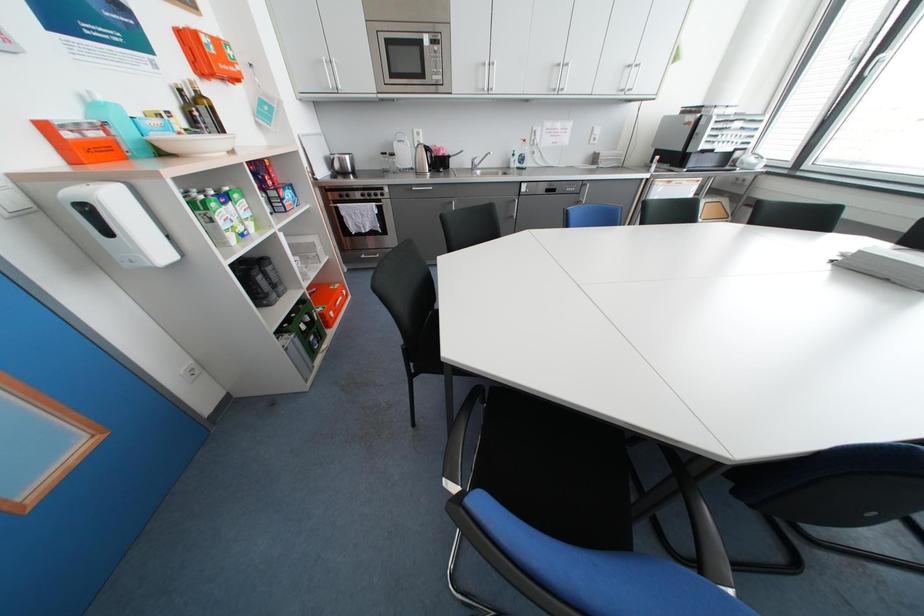
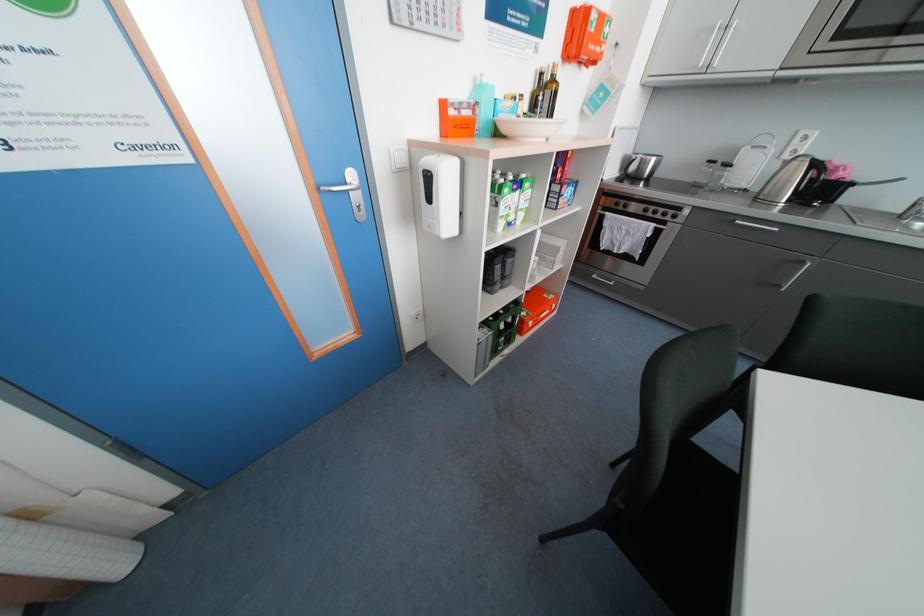
Question: The camera is either moving clockwise (left) or counter-clockwise (right) around the object. The first image is from the beginning of the video and the second image is from the end. Is the camera moving left or right when shooting the video?

Choices:
 (A) Left
 (B) Right

Answer: (B)